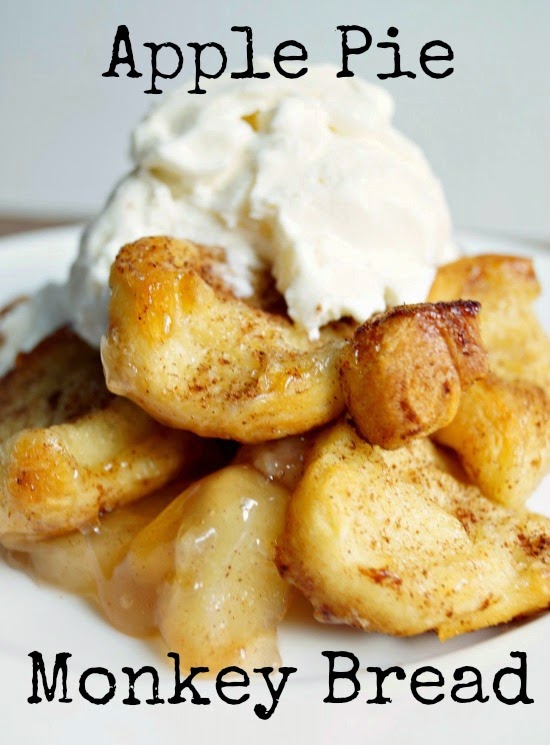
This screenshot has width=550, height=745. Find the location of `plate`. plate is located at coordinates (536, 638).